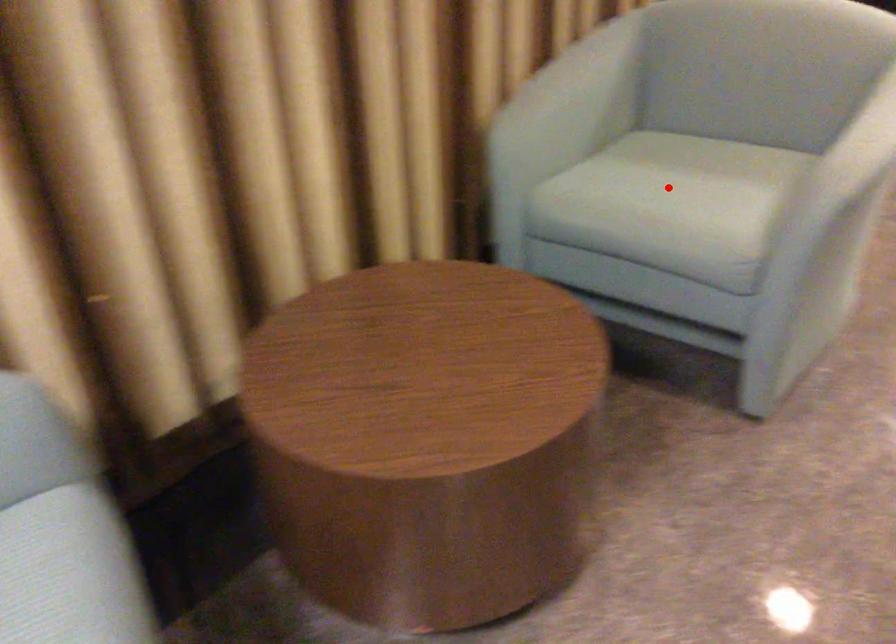
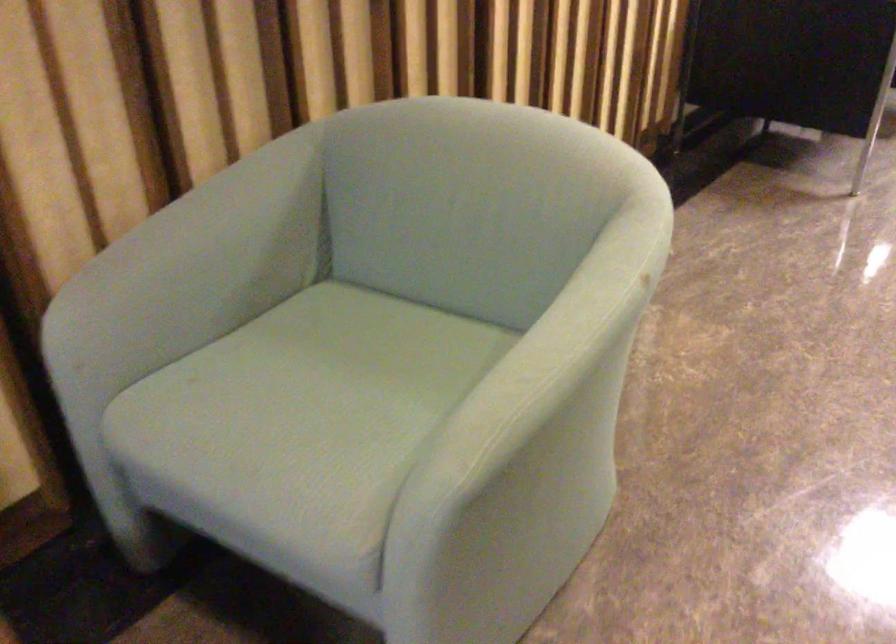
Question: I am providing you with two images of the same scene from different viewpoints. Image1 has a red point marked. In image2, the corresponding 3D location appears at what relative position? Reply with the corresponding letter.

Choices:
 (A) Closer
 (B) Farther

Answer: (A)